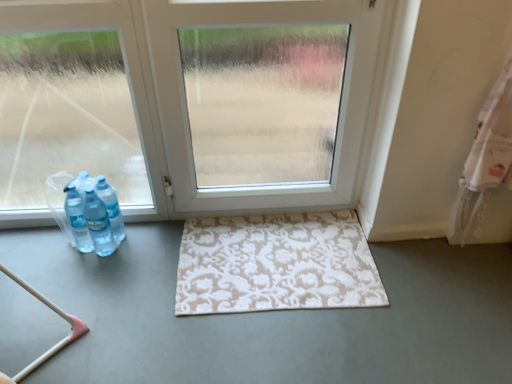
This screenshot has height=384, width=512. I want to click on vacant area that is in front of white matte door at center, so click(x=262, y=284).